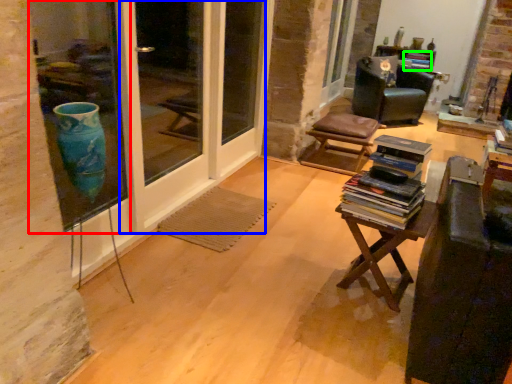
Question: Which object is the farthest from window (highlighted by a red box)? Choose among these: screen door (highlighted by a blue box) or book (highlighted by a green box).

Choices:
 (A) screen door
 (B) book

Answer: (B)